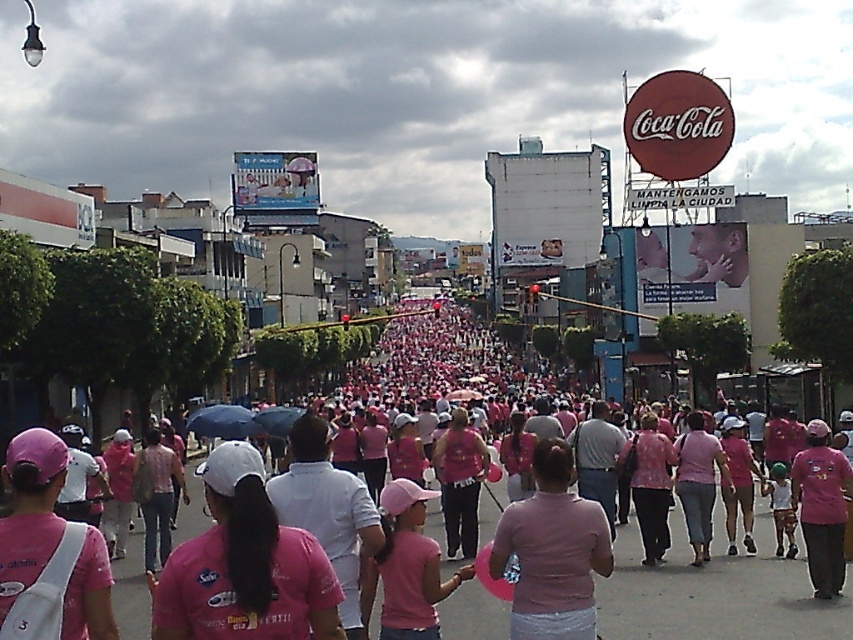
You are a photographer standing at the edge of the crowd. You want to capture a photo that includes both the pink fabric shirts at center and the blue matte umbrella at center. Which object should appear to the left in your photo?

The blue matte umbrella at center should appear to the left in your photo because the pink fabric shirts at center is positioned on the right side of blue matte umbrella at center.

From the picture: You are standing at the point marked at (381, 492) on the image. There is another point 154.12 feet away from you. Given that the average walking speed is 3 feet per second, how many seconds will it take to reach that point if you walk directly towards it?

At an average walking speed of 3 feet per second, it will take 154.12 divided by 3, which is approximately 51.37 seconds to reach the point 154.12 feet away.